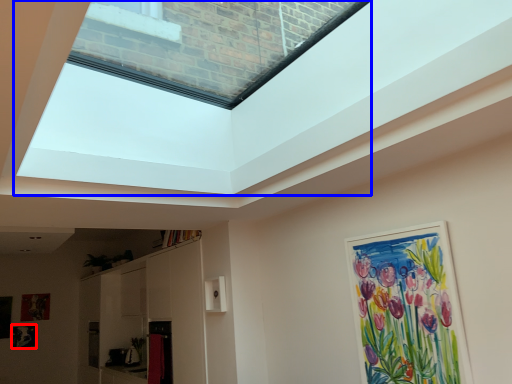
Question: Which object is further to the camera taking this photo, picture frame (highlighted by a red box) or window screen (highlighted by a blue box)?

Choices:
 (A) picture frame
 (B) window screen

Answer: (A)